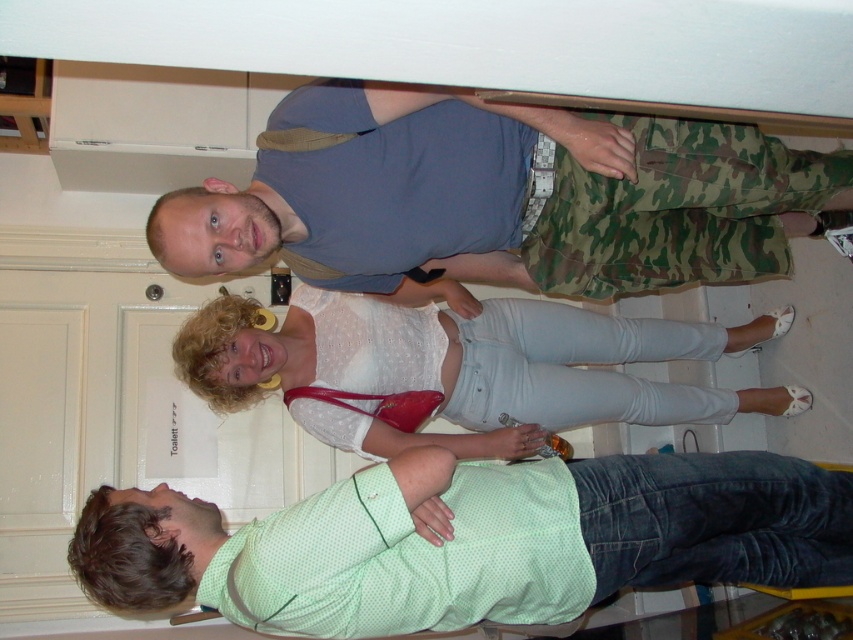
You are a photographer setting up for a group photo. You notice the green dotted shirt at center and the white matte blouse at center. Which clothing item is closer to the camera?

The green dotted shirt at center is in front of the white matte blouse at center, so it is closer to the camera.